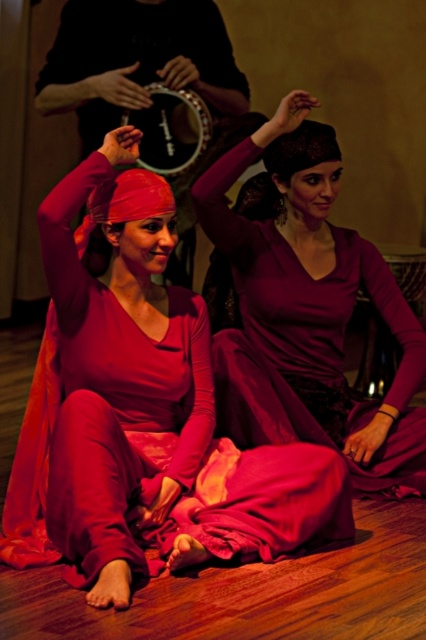
You are a photographer setting up for a dance performance. You need to position your camera so that both the matte pink fabric at center and the matte purple dress at center are in frame. Based on their positions, which object should you place on the left side of your camera frame?

The matte pink fabric at center is to the left of the matte purple dress at center, so you should place the matte pink fabric at center on the left side of your camera frame.

You are a photographer capturing the dance performance. You need to focus on the matte pink fabric at center and the black leather tambourine at upper center. Which object should you adjust your camera to prioritize focusing on first if you want to ensure the foreground object is sharp?

The matte pink fabric at center should be prioritized for focus since it is in front of the black leather tambourine at upper center, making it the foreground object.